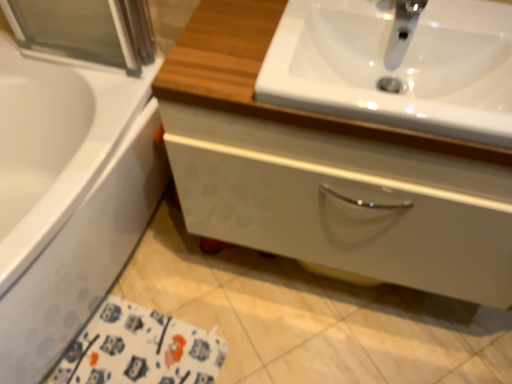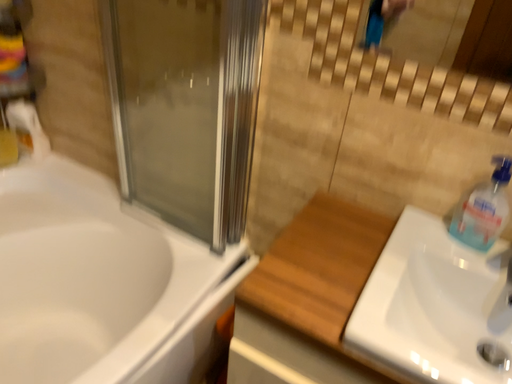
Question: How did the camera likely rotate when shooting the video?

Choices:
 (A) rotated upward
 (B) rotated downward

Answer: (A)